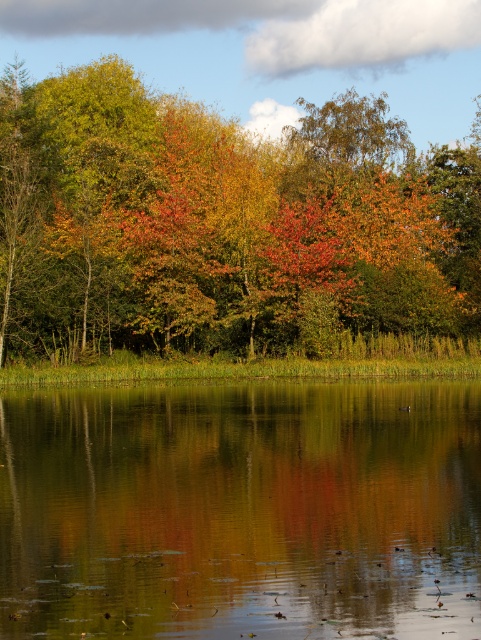
Is point (225, 449) farther from viewer compared to point (339, 250)?

No, (225, 449) is in front of (339, 250).

Who is more forward, (193, 620) or (75, 323)?

Point (193, 620)

Who is more distant from viewer, (113, 452) or (47, 164)?

The point (47, 164) is behind.

This screenshot has width=481, height=640. I want to click on green reflective water at center, so click(240, 512).